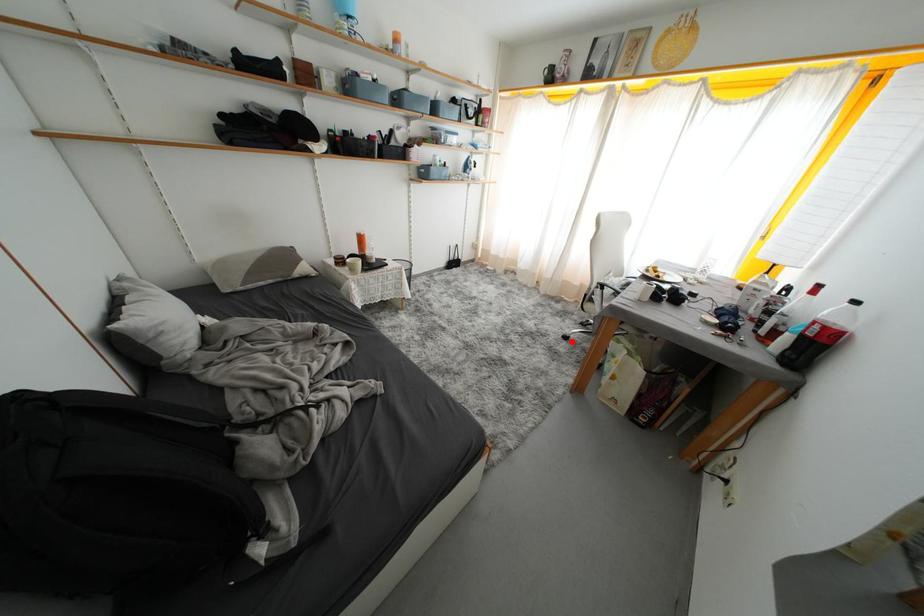
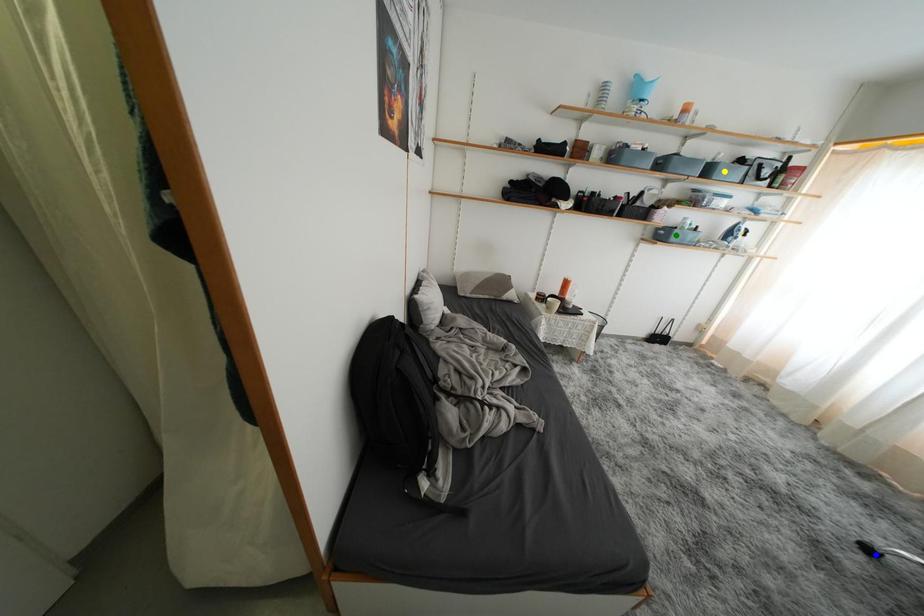
Question: I am providing you with two images of the same scene from different viewpoints. A red point is marked on the first image. You are given multiple points on the second image. Which point in image 2 represents the same 3d spot as the red point in image 1?

Choices:
 (A) yellow point
 (B) green point
 (C) blue point

Answer: (C)